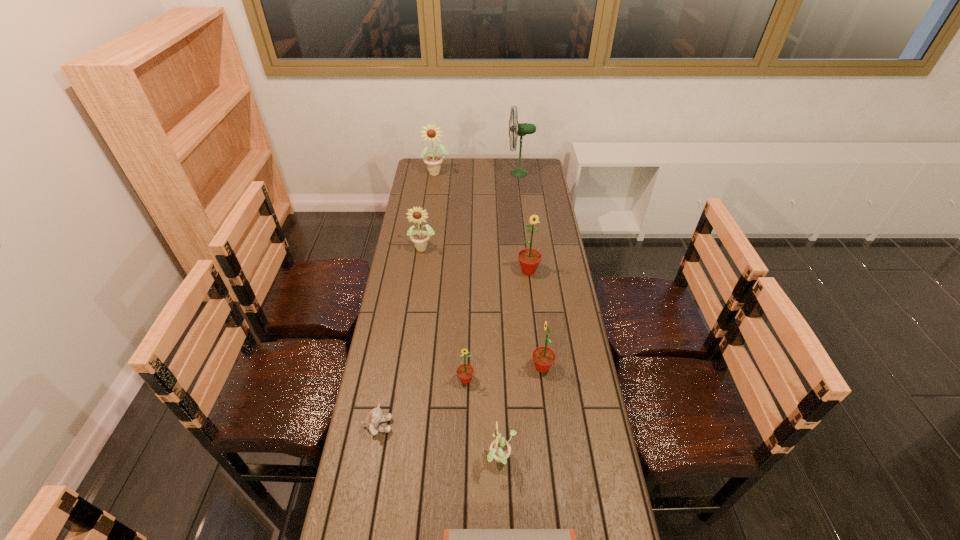
The height and width of the screenshot is (540, 960). Identify the location of blank area located on the face of the second smallest green sunflower. (458, 367).

Where is `vacant space located 0.320m on the face of the second smallest green sunflower`? The height and width of the screenshot is (540, 960). vacant space located 0.320m on the face of the second smallest green sunflower is located at coordinates (438, 367).

Locate an element on the screen. This screenshot has width=960, height=540. vacant space located 0.130m on the face of the second smallest green sunflower is located at coordinates (492, 367).

Locate an element on the screen. This screenshot has width=960, height=540. vacant position located 0.230m on the front-facing side of the fifth nearest sunflower is located at coordinates (417, 294).

Image resolution: width=960 pixels, height=540 pixels. In order to click on free space located 0.150m on the front-facing side of the smallest yellow sunflower in this screenshot , I will do `click(436, 460)`.

Find the location of a particular element. free point located 0.330m on the front-facing side of the smallest yellow sunflower is located at coordinates (373, 460).

Find the location of a particular element. The image size is (960, 540). free space located 0.080m on the front-facing side of the smallest yellow sunflower is located at coordinates (459, 460).

Where is `vacant space located 0.290m on the face of the fourth sunflower from right to left`? vacant space located 0.290m on the face of the fourth sunflower from right to left is located at coordinates (463, 476).

At what (x,y) coordinates should I click in order to perform the action: click on vacant space located on the face of the gray teddy bear. Please return your answer as a coordinate pair (x, y). This screenshot has height=540, width=960. Looking at the image, I should click on (502, 426).

Find the location of a particular element. This screenshot has width=960, height=540. fan present at the far edge is located at coordinates (519, 129).